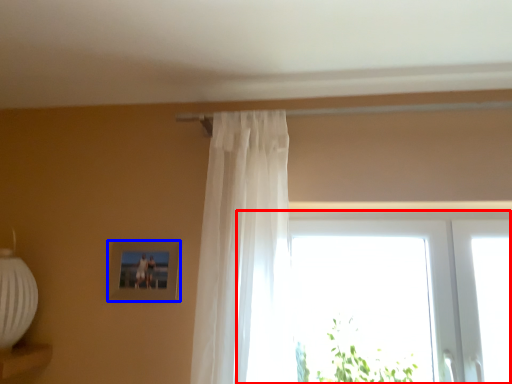
Question: Which object is closer to the camera taking this photo, window (highlighted by a red box) or picture frame (highlighted by a blue box)?

Choices:
 (A) window
 (B) picture frame

Answer: (A)